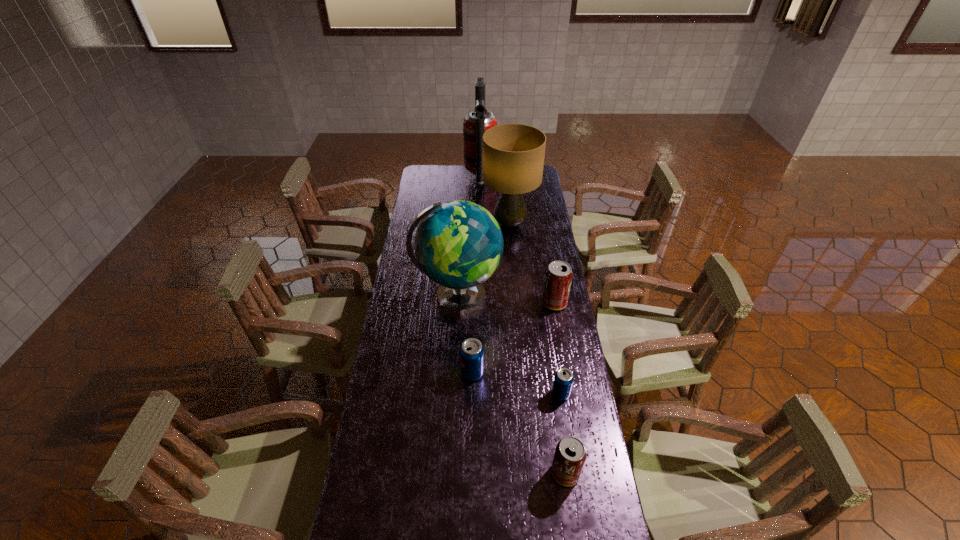
Find the location of a particular element. The height and width of the screenshot is (540, 960). vacant area in the image that satisfies the following two spatial constraints: 1. on the front surface of the farthest pop soda; 2. on the right side of the blue globe is located at coordinates coord(457,303).

Locate an element on the screen. vacant position in the image that satisfies the following two spatial constraints: 1. on the back side of the nearer blue pop soda; 2. on the left side of the nearest pop soda is located at coordinates (554, 394).

Find the location of `vacant space that satisfies the following two spatial constraints: 1. on the front label side of the lampshade; 2. on the right side of the fire extinguisher`. vacant space that satisfies the following two spatial constraints: 1. on the front label side of the lampshade; 2. on the right side of the fire extinguisher is located at coordinates (480, 224).

Identify the location of free space that satisfies the following two spatial constraints: 1. on the back side of the shortest object; 2. on the right side of the bigger red soda can. Image resolution: width=960 pixels, height=540 pixels. (547, 303).

The image size is (960, 540). What are the coordinates of `vacant area in the image that satisfies the following two spatial constraints: 1. on the back side of the farther red soda can; 2. on the right side of the left blue pop soda` in the screenshot? It's located at (473, 303).